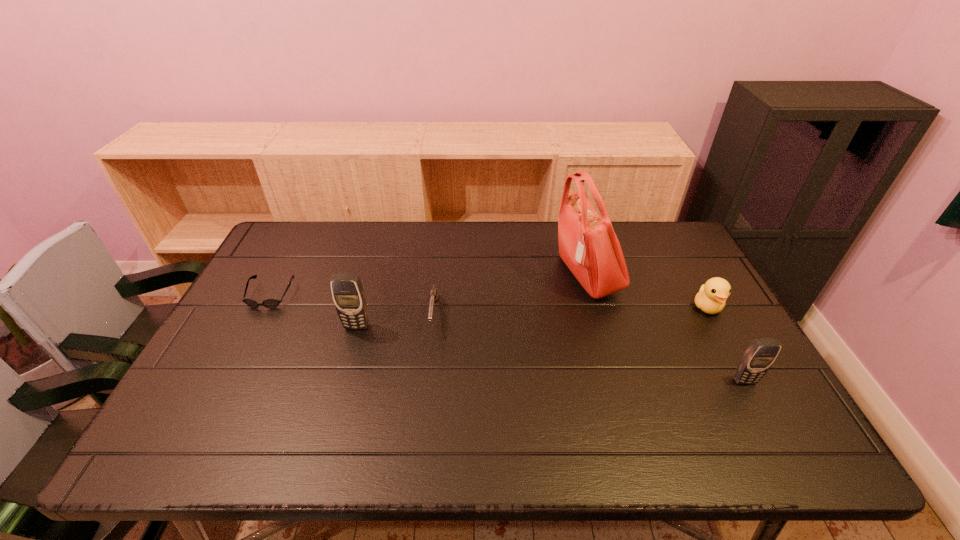
To make them evenly spaced by inserting another cellular_telephone among them, please locate a free space for this new cellular_telephone. Please provide its 2D coordinates. Your answer should be formatted as a tuple, i.e. [(x, y)], where the tuple contains the x and y coordinates of a point satisfying the conditions above.

[(540, 352)]